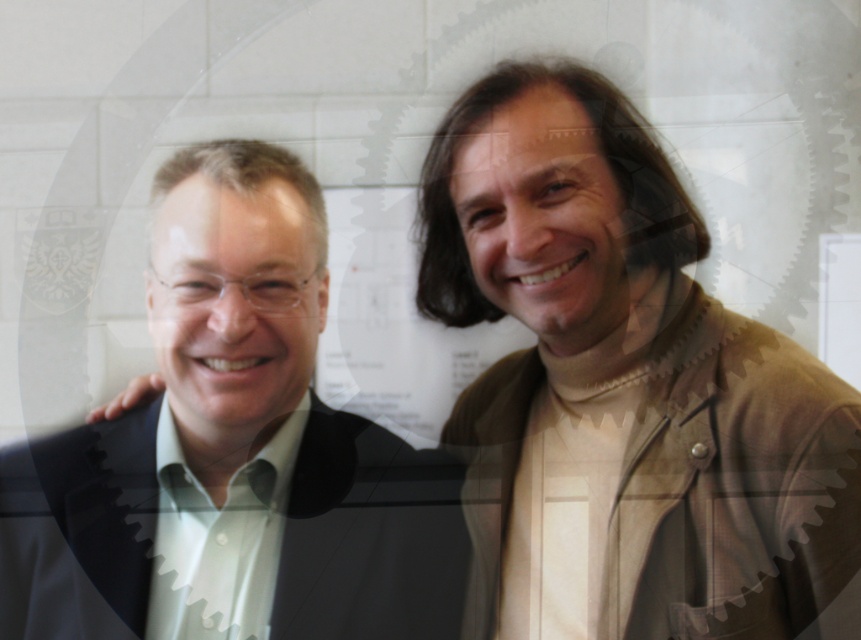
Question: Can you confirm if matte black suit at left is positioned above matte black jacket at right?

Choices:
 (A) yes
 (B) no

Answer: (A)

Question: Can you confirm if matte black suit at left is smaller than matte black jacket at right?

Choices:
 (A) no
 (B) yes

Answer: (B)

Question: Is matte black suit at left below matte black jacket at right?

Choices:
 (A) no
 (B) yes

Answer: (A)

Question: Among these points, which one is farthest from the camera?

Choices:
 (A) (381, 604)
 (B) (831, 464)

Answer: (A)